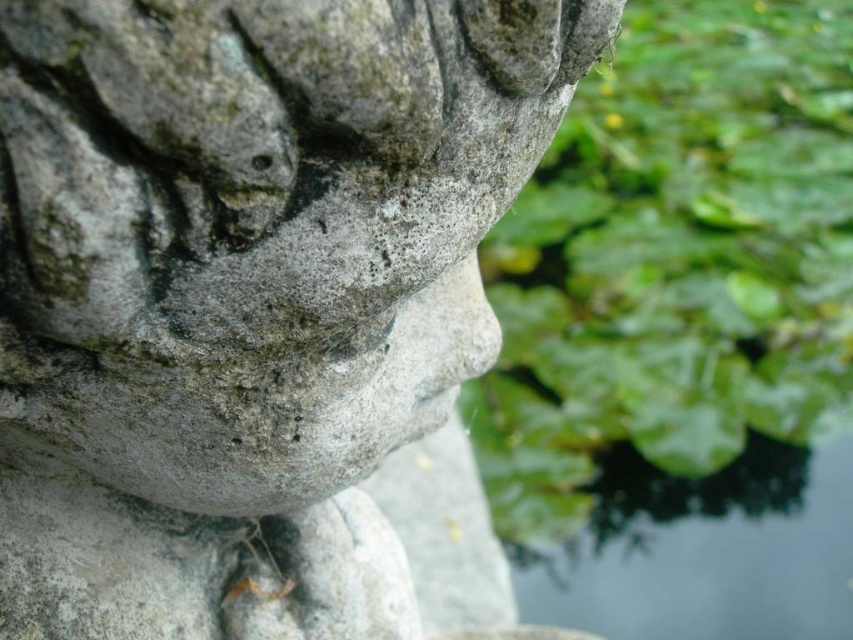
You are a maintenance worker who needs to clean the transparent water at lower right. The gray stone statue at center is in the way. Can you move the statue to access the water? Please consider the distance between them.

The gray stone statue at center and transparent water at lower right are 99.18 centimeters apart. Since the statue is a heavy stone structure, you cannot move it easily. Therefore, you can access the transparent water at lower right without moving the statue because they are already separated by nearly a meter.

You are standing in front of a stone sculpture in a garden. You notice two points marked on the sculpture at coordinates point (457,300) and point (618,532). Which point is closer to you?

Point (457,300) is in front of point (618,532), so it is closer to you.

From the picture: You are standing 30 inches away from a stone sculpture in a garden. You want to take a closer look but need to know if you can move forward without stepping on any plants. The point you are currently at is labeled as point (372,532). Can you safely move 1.5 inches forward towards the sculpture?

The point (372,532) is currently 28.57 inches away from the camera. Moving 1.5 inches forward would bring you to 27.07 inches away, which should be safe as there is no mention of obstacles or plants in the immediate path between the point and the sculpture.